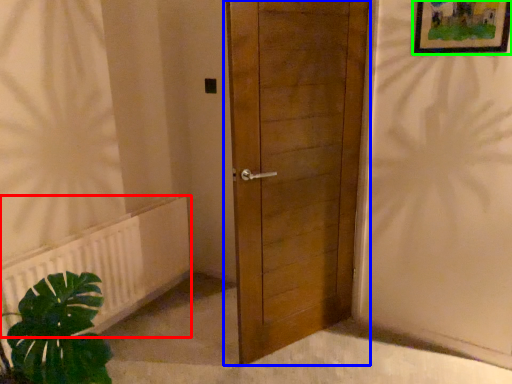
Question: Which is nearer to the radiator (highlighted by a red box)? door (highlighted by a blue box) or picture frame (highlighted by a green box).

Choices:
 (A) door
 (B) picture frame

Answer: (A)